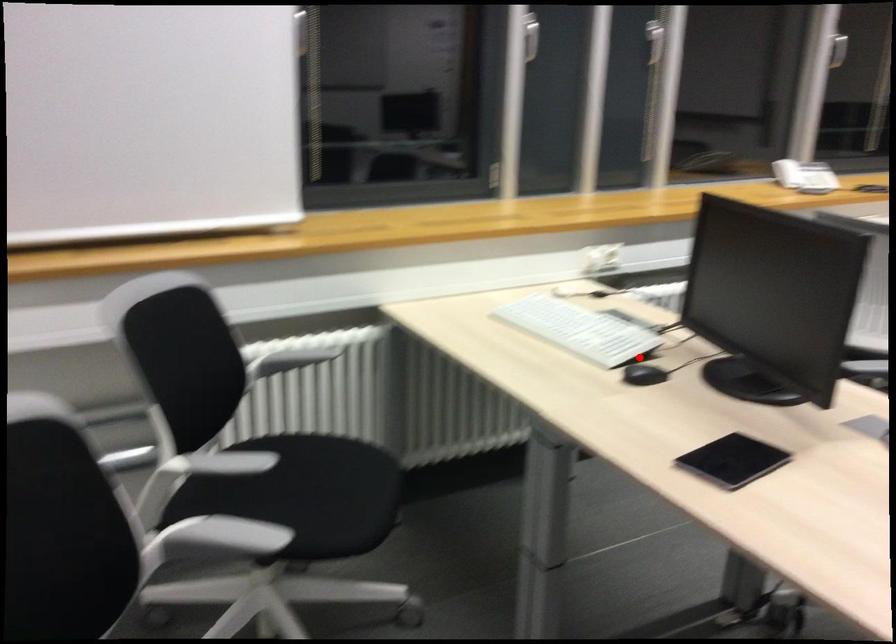
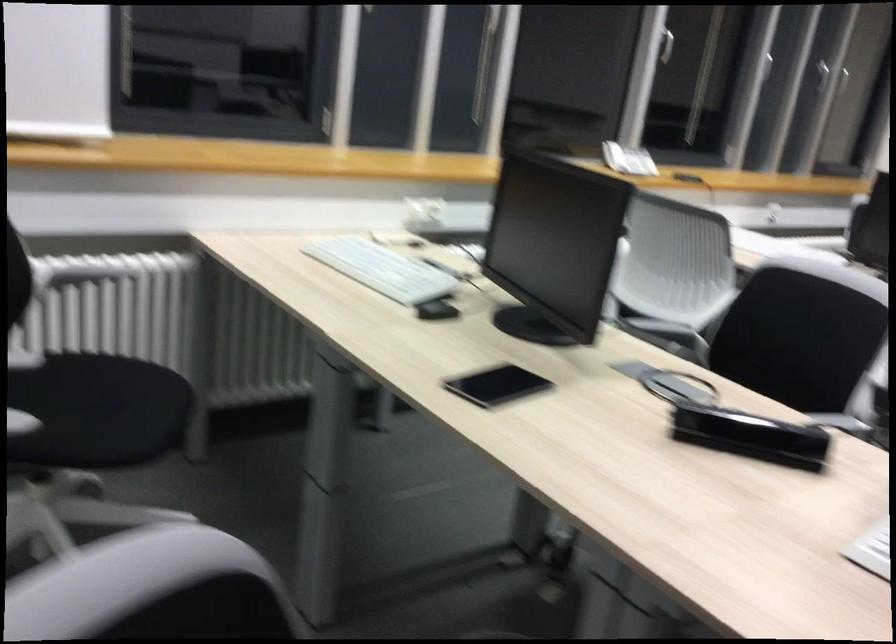
Find the pixel in the second image that matches the highlighted location in the first image.

(435, 297)